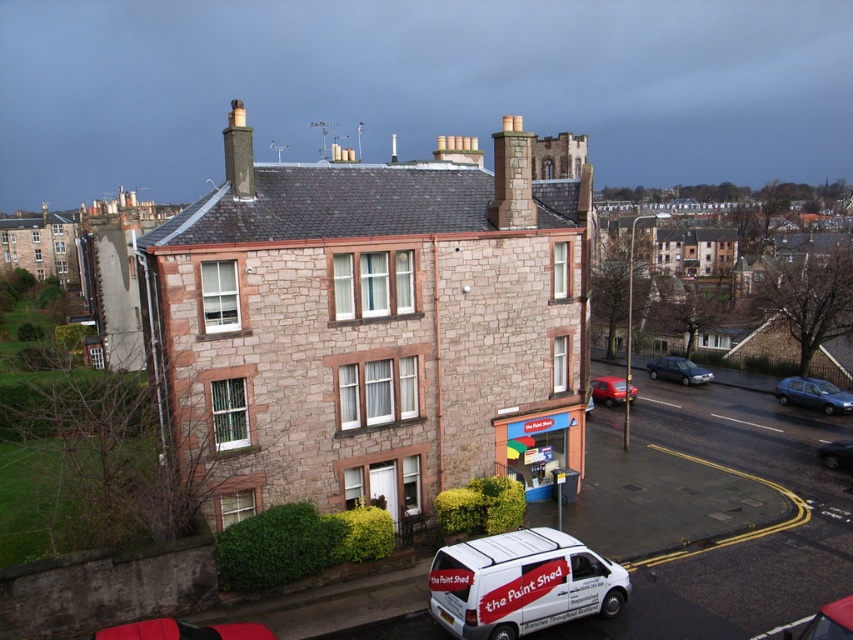
Which is more to the left, white matte van at lower center or metallic blue sedan at lower right?

white matte van at lower center

Which is more to the right, white matte van at lower center or metallic blue sedan at lower right?

From the viewer's perspective, metallic blue sedan at lower right appears more on the right side.

Is point (469, 564) closer to camera compared to point (788, 400)?

That is True.

Locate an element on the screen. The image size is (853, 640). white matte van at lower center is located at coordinates (521, 582).

Based on the photo, does white matte van at lower center appear under stone chimney at center?

Yes.

Between point (566, 572) and point (521, 141), which one is positioned behind?

The point (521, 141) is more distant.

Does point (445, 625) lie behind point (496, 205)?

No, (445, 625) is closer to viewer.

Identify the location of white matte van at lower center. (521, 582).

Does metallic red car at lower left appear under metallic blue sedan at lower right?

Yes.

Between metallic red car at lower left and metallic blue sedan at lower right, which one is positioned higher?

Positioned higher is metallic blue sedan at lower right.

Describe the element at coordinates (183, 630) in the screenshot. I see `metallic red car at lower left` at that location.

Identify the location of metallic red car at lower left. Image resolution: width=853 pixels, height=640 pixels. (183, 630).